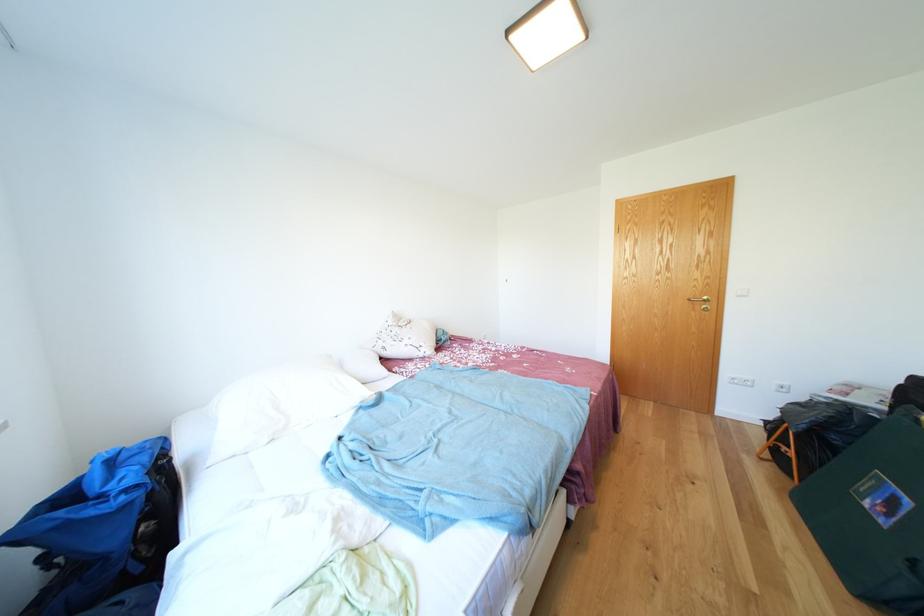
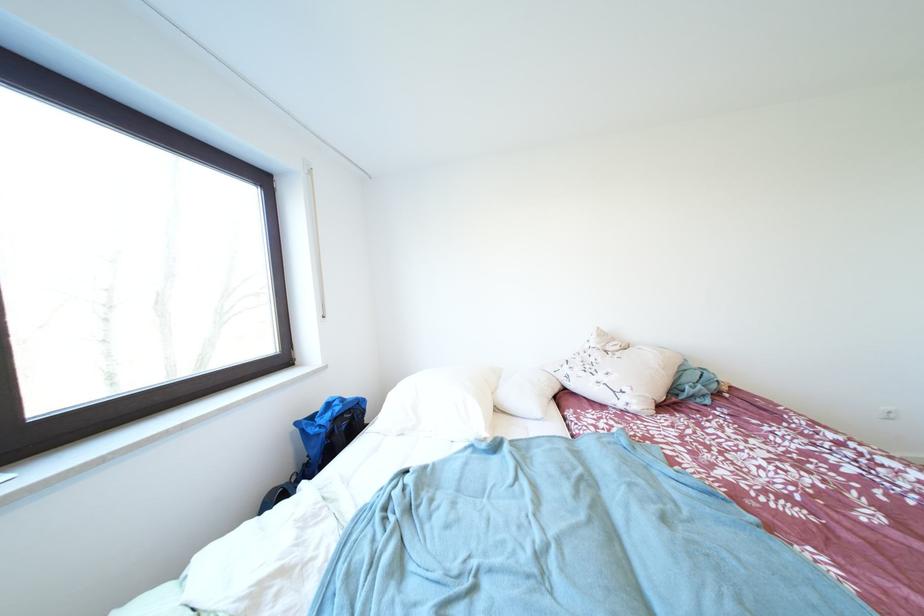
Question: The camera is either moving clockwise (left) or counter-clockwise (right) around the object. The first image is from the beginning of the video and the second image is from the end. Is the camera moving left or right when shooting the video?

Choices:
 (A) Left
 (B) Right

Answer: (B)